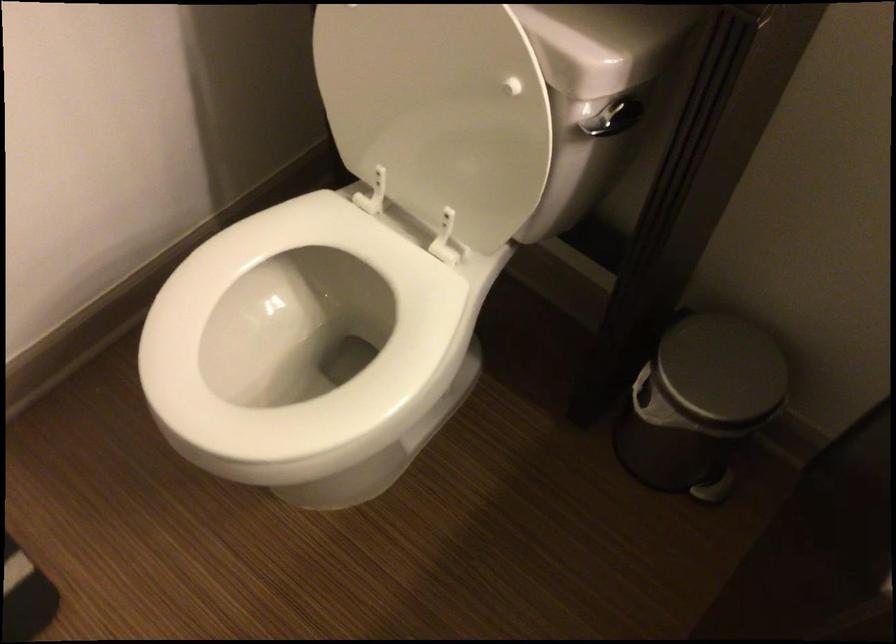
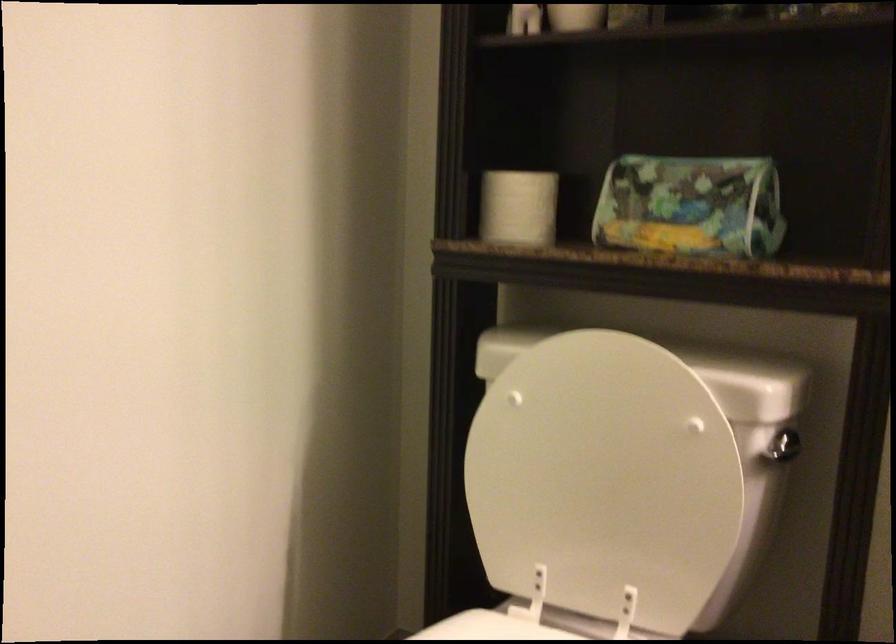
The first image is from the beginning of the video and the second image is from the end. How did the camera likely rotate when shooting the video?

The camera's rotation is toward right-up.